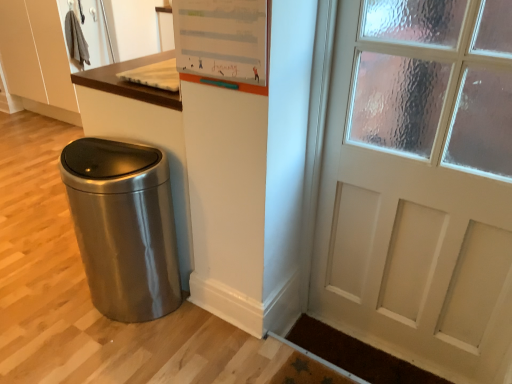
Question: From a real-world perspective, is satin metallic trash can at lower left positioned over brown textured mat at lower right based on gravity?

Choices:
 (A) no
 (B) yes

Answer: (B)

Question: Does satin metallic trash can at lower left appear on the right side of brown textured mat at lower right?

Choices:
 (A) no
 (B) yes

Answer: (A)

Question: Is brown textured mat at lower right surrounded by satin metallic trash can at lower left?

Choices:
 (A) no
 (B) yes

Answer: (A)

Question: Considering the relative positions of satin metallic trash can at lower left and brown textured mat at lower right in the image provided, is satin metallic trash can at lower left to the left of brown textured mat at lower right from the viewer's perspective?

Choices:
 (A) no
 (B) yes

Answer: (B)

Question: From a real-world perspective, is satin metallic trash can at lower left positioned under brown textured mat at lower right based on gravity?

Choices:
 (A) yes
 (B) no

Answer: (B)

Question: Is satin metallic trash can at lower left positioned with its back to brown textured mat at lower right?

Choices:
 (A) no
 (B) yes

Answer: (A)

Question: Does brown textured mat at lower right have a lesser width compared to white matte dry erase board at upper center?

Choices:
 (A) yes
 (B) no

Answer: (B)

Question: Is brown textured mat at lower right behind white matte dry erase board at upper center?

Choices:
 (A) yes
 (B) no

Answer: (A)

Question: Does brown textured mat at lower right lie in front of white matte dry erase board at upper center?

Choices:
 (A) yes
 (B) no

Answer: (B)

Question: Is brown textured mat at lower right positioned beyond the bounds of white matte dry erase board at upper center?

Choices:
 (A) no
 (B) yes

Answer: (B)

Question: Does brown textured mat at lower right appear on the left side of white matte dry erase board at upper center?

Choices:
 (A) no
 (B) yes

Answer: (A)

Question: From the image's perspective, would you say brown textured mat at lower right is shown under white matte dry erase board at upper center?

Choices:
 (A) no
 (B) yes

Answer: (B)

Question: Is satin metallic trash can at lower left at the back of brown textured mat at lower right?

Choices:
 (A) no
 (B) yes

Answer: (A)